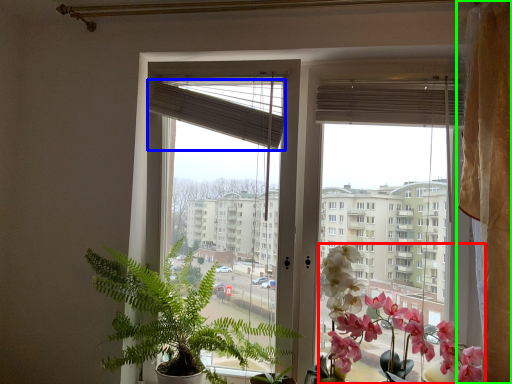
Question: Based on their relative distances, which object is nearer to flower (highlighted by a red box)? Choose from blind (highlighted by a blue box) and curtain (highlighted by a green box).

Choices:
 (A) blind
 (B) curtain

Answer: (B)